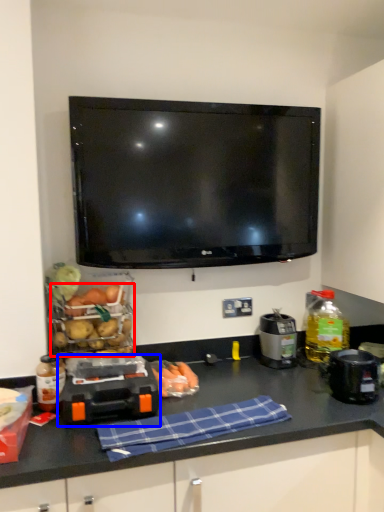
Question: Which object appears farthest to the camera in this image, food (highlighted by a red box) or appliance (highlighted by a blue box)?

Choices:
 (A) food
 (B) appliance

Answer: (A)